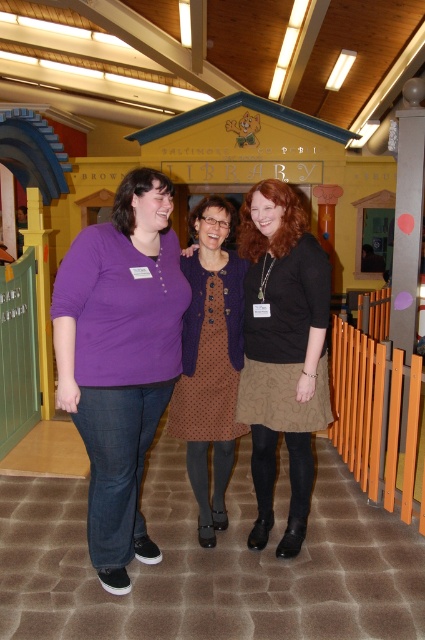
Looking at this image, you are a photographer at the library event and need to capture a clear photo of both the purple cotton shirt at center and the brown textured dress at center. Which one should you focus on first to ensure both are in focus?

The purple cotton shirt at center is in front of the brown textured dress at center, so you should focus on the brown textured dress at center first to ensure both are in focus.

Where is the brown textured dress at center located in the image?

The brown textured dress at center is located at point (283, 349).

You are a fashion designer observing a library event. You notice two people wearing the purple cotton shirt at center and the brown dotted dress at center. Which clothing item appears taller on their respective wearers?

The purple cotton shirt at center appears taller on its wearer compared to the brown dotted dress at center because it has a greater height.